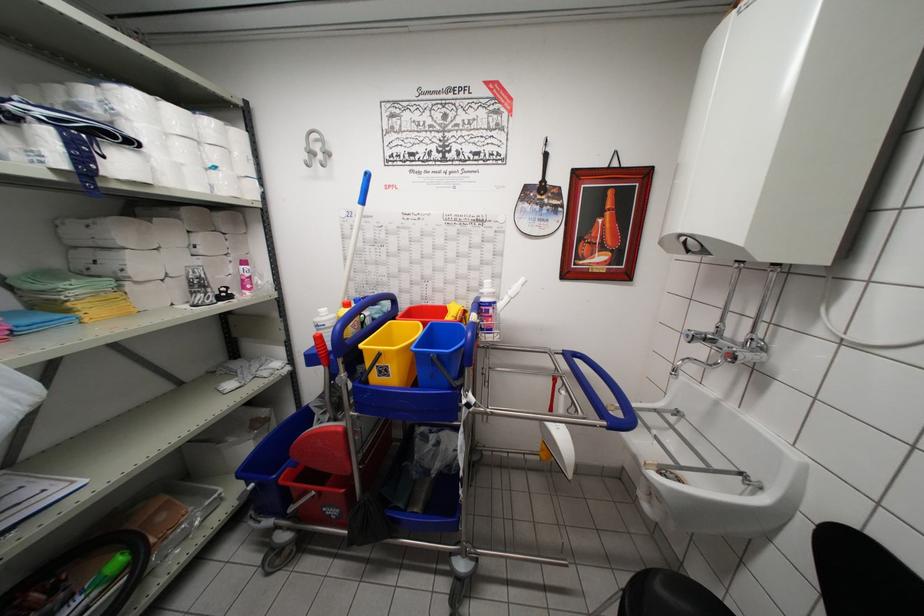
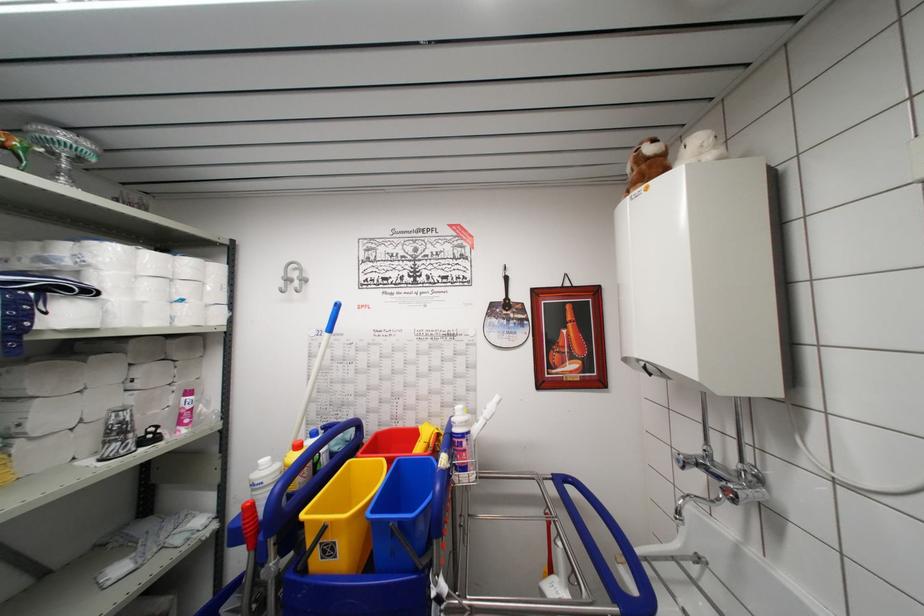
Find the pixel in the second image that matches [489,314] in the first image.

(460, 447)